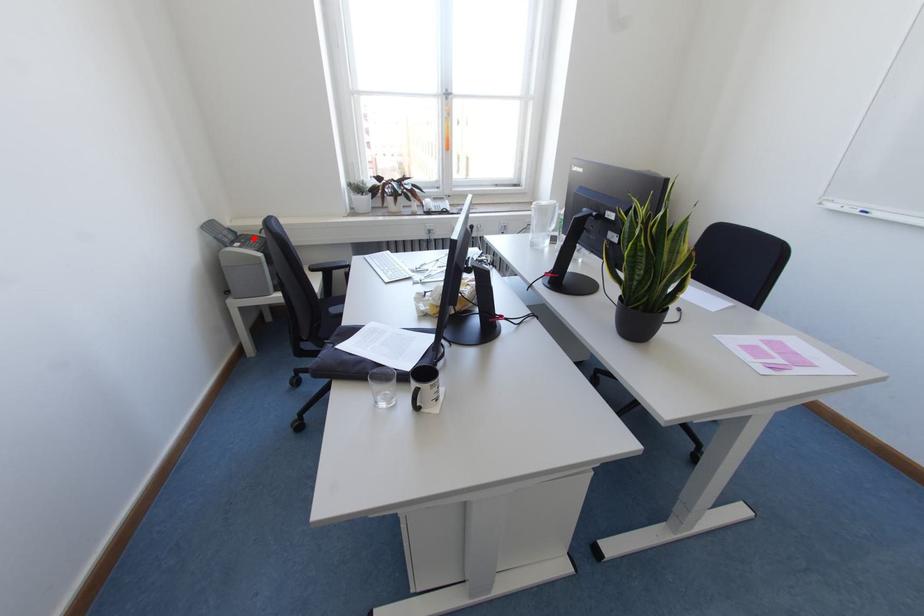
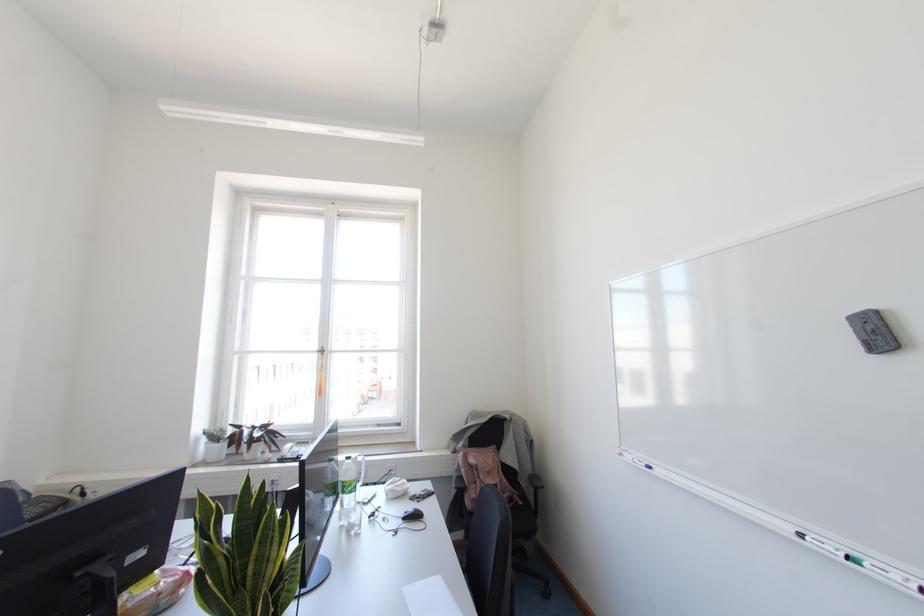
The point at the highlighted location is marked in the first image. Where is the corresponding point in the second image?

(46, 501)